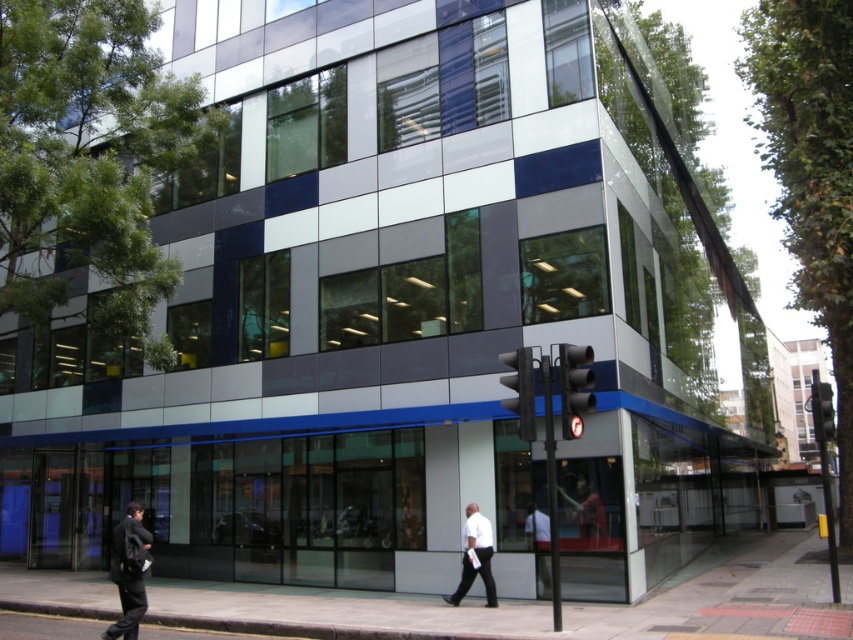
Who is more distant from viewer, (314, 604) or (544, 548)?

The point (314, 604) is behind.

Does smooth concrete pavement at lower center appear on the left side of white fabric shirt at lower center?

Indeed, smooth concrete pavement at lower center is positioned on the left side of white fabric shirt at lower center.

Is point (229, 605) closer to camera compared to point (546, 536)?

No.

Image resolution: width=853 pixels, height=640 pixels. Find the location of `smooth concrete pavement at lower center`. smooth concrete pavement at lower center is located at coordinates (541, 604).

Is dark gray suit at lower left positioned behind white fabric shirt at lower center?

No, dark gray suit at lower left is in front of white fabric shirt at lower center.

Who is higher up, dark gray suit at lower left or white fabric shirt at lower center?

dark gray suit at lower left

This screenshot has height=640, width=853. In order to click on dark gray suit at lower left in this screenshot , I will do `click(128, 573)`.

Can you confirm if white matte shirt at center is positioned to the right of white fabric shirt at lower center?

Incorrect, white matte shirt at center is not on the right side of white fabric shirt at lower center.

Who is more forward, (463, 568) or (543, 554)?

Point (463, 568)

Where is `white matte shirt at center`? Image resolution: width=853 pixels, height=640 pixels. white matte shirt at center is located at coordinates (476, 556).